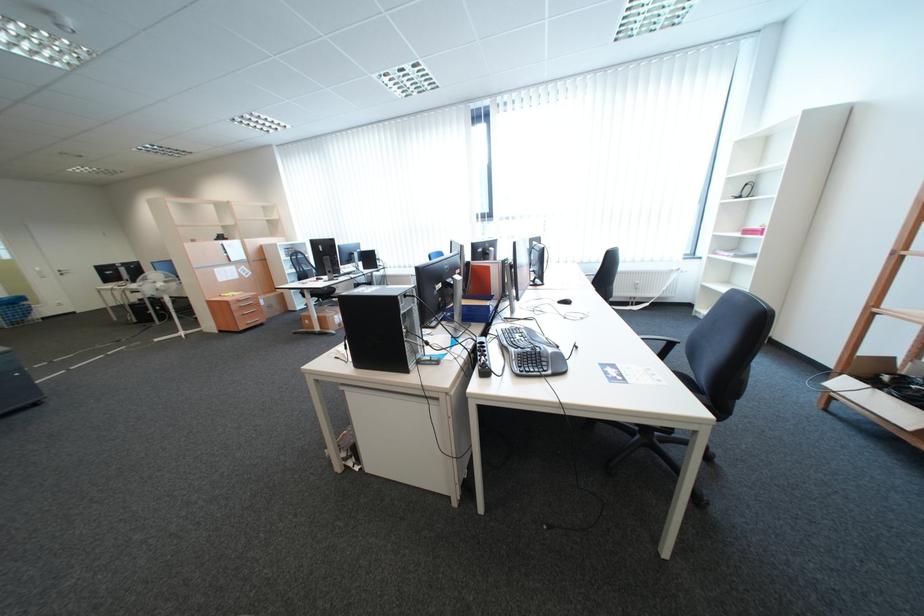
What do you see at coordinates (727, 334) in the screenshot? The image size is (924, 616). I see `the black chair surface` at bounding box center [727, 334].